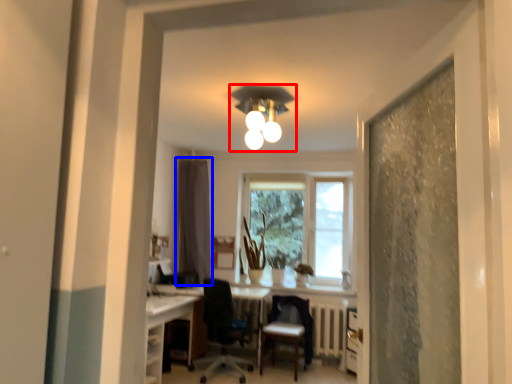
Question: Which object appears closest to the camera in this image, light fixture (highlighted by a red box) or curtain (highlighted by a blue box)?

Choices:
 (A) light fixture
 (B) curtain

Answer: (A)